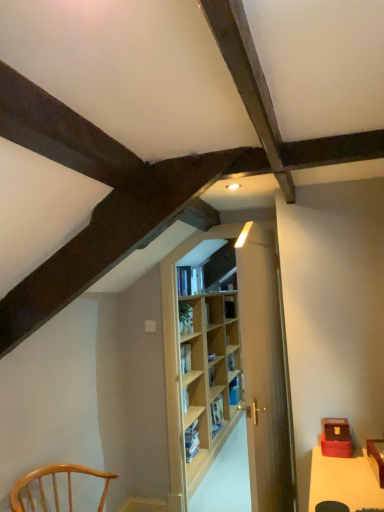
At what (x,y) coordinates should I click in order to perform the action: click on wooden door at center. Please return your answer as a coordinate pair (x, y). This screenshot has width=384, height=512. Looking at the image, I should click on (265, 372).

Measure the distance between light wood shelf at center and camera.

The distance of light wood shelf at center from camera is 3.34 meters.

What do you see at coordinates (54, 485) in the screenshot?
I see `light brown wooden chair at lower left` at bounding box center [54, 485].

In order to face hardcover book at center, which appears as the second book when viewed from the right, should I rotate leftwards or rightwards?

Turn right by 0.275 degrees to look at hardcover book at center, which appears as the second book when viewed from the right.

The image size is (384, 512). What do you see at coordinates (190, 280) in the screenshot? I see `hardcover book at center, the 1th book positioned from the front` at bounding box center [190, 280].

In order to click on wooden door at center in this screenshot , I will do click(265, 372).

Which of these two, blue hardcover book at center, positioned as the 2th book in top-to-bottom order, or wooden door at center, is smaller?

blue hardcover book at center, positioned as the 2th book in top-to-bottom order, is smaller.

Is wooden door at center at the back of blue hardcover book at center, placed as the second book when sorted from front to back?

No, blue hardcover book at center, placed as the second book when sorted from front to back, is not facing the opposite direction of wooden door at center.

Looking at their sizes, would you say blue hardcover book at center, arranged as the 2th book when viewed from the left, is wider or thinner than wooden door at center?

In the image, blue hardcover book at center, arranged as the 2th book when viewed from the left, appears to be more narrow than wooden door at center.

From a real-world perspective, is blue hardcover book at center, positioned as the 2th book in top-to-bottom order, positioned above or below hardcover book at center, which appears as the second book when viewed from the right?

In terms of real-world spatial position, blue hardcover book at center, positioned as the 2th book in top-to-bottom order, is below hardcover book at center, which appears as the second book when viewed from the right.

Is hardcover book at center, which appears as the second book when viewed from the right, at the back of blue hardcover book at center, placed as the second book when sorted from front to back?

That's not correct — blue hardcover book at center, placed as the second book when sorted from front to back, is not looking away from hardcover book at center, which appears as the second book when viewed from the right.

Measure the distance between blue hardcover book at center, which ranks as the first book in back-to-front order, and hardcover book at center, which is the second book in back-to-front order.

They are 5.78 feet apart.

Which object is positioned more to the left, hardcover book at center, which appears as the 2th book when ordered from the bottom, or light wood shelf at center?

Positioned to the left is hardcover book at center, which appears as the 2th book when ordered from the bottom.

Would you consider hardcover book at center, which appears as the second book when viewed from the right, to be distant from light wood shelf at center?

No, hardcover book at center, which appears as the second book when viewed from the right, is not far away from light wood shelf at center.

In terms of height, does hardcover book at center, which is the second book in back-to-front order, look taller or shorter compared to light wood shelf at center?

In the image, hardcover book at center, which is the second book in back-to-front order, appears to be shorter than light wood shelf at center.

Which is in front, point (181, 267) or point (193, 387)?

The point (181, 267) is closer to the camera.

Is wooden door at center not within light wood shelf at center?

Yes, wooden door at center is outside of light wood shelf at center.

Which object is thinner, wooden door at center or light wood shelf at center?

Thinner between the two is wooden door at center.

Is wooden door at center next to light wood shelf at center and touching it?

wooden door at center is not next to light wood shelf at center, and they're not touching.

Which point is more forward, (249, 257) or (240, 373)?

Positioned in front is point (249, 257).

Consider the image. From a real-world perspective, is light wood shelf at center under light brown wooden chair at lower left?

No, from a real-world perspective, light wood shelf at center is not under light brown wooden chair at lower left.

From the image's perspective, between light wood shelf at center and light brown wooden chair at lower left, who is located below?

From the image's view, light brown wooden chair at lower left is below.

Which of these two, light wood shelf at center or light brown wooden chair at lower left, is thinner?

Thinner between the two is light wood shelf at center.

Considering the positions of point (222, 426) and point (179, 275), is point (222, 426) closer or farther from the camera than point (179, 275)?

Point (222, 426) is positioned farther from the camera compared to point (179, 275).

Considering the relative sizes of light wood shelf at center and hardcover book at center, which appears as the 2th book when ordered from the bottom, in the image provided, is light wood shelf at center taller than hardcover book at center, which appears as the 2th book when ordered from the bottom,?

Indeed, light wood shelf at center has a greater height compared to hardcover book at center, which appears as the 2th book when ordered from the bottom.

At what (x,y) coordinates should I click in order to perform the action: click on book that is above the light wood shelf at center (from the image's perspective). Please return your answer as a coordinate pair (x, y). The width and height of the screenshot is (384, 512). Looking at the image, I should click on (190, 280).

Looking at their sizes, would you say light wood shelf at center is wider or thinner than hardcover book at center, which is the second book in back-to-front order?

Considering their sizes, light wood shelf at center looks broader than hardcover book at center, which is the second book in back-to-front order.

Which of these two, hardcover book at center, positioned as the first book in top-to-bottom order, or light brown wooden chair at lower left, stands taller?

Standing taller between the two is light brown wooden chair at lower left.

Does point (189, 290) lie behind point (21, 500)?

Yes, it is.

From the image's perspective, is hardcover book at center, which is the second book in back-to-front order, on light brown wooden chair at lower left?

Yes.

Find the location of a particular element. the 2nd book behind the wooden door at center is located at coordinates (235, 390).

This screenshot has width=384, height=512. In the image, there is a hardcover book at center, the first book positioned from the left. Find the location of `book below it (from a real-world perspective)`. book below it (from a real-world perspective) is located at coordinates (235, 390).

Considering their positions, is light wood shelf at center positioned further to wooden door at center than blue hardcover book at center, which is the first book in right-to-left order?

blue hardcover book at center, which is the first book in right-to-left order, lies further to wooden door at center than the other object.

Based on their spatial positions, is light brown wooden chair at lower left or light wood shelf at center further from wooden door at center?

light wood shelf at center is positioned further to the anchor wooden door at center.

Estimate the real-world distances between objects in this image. Which object is further from light brown wooden chair at lower left, blue hardcover book at center, which is the first book in right-to-left order, or hardcover book at center, which appears as the 2th book when ordered from the bottom?

Based on the image, blue hardcover book at center, which is the first book in right-to-left order, appears to be further to light brown wooden chair at lower left.

From the image, which object appears to be nearer to hardcover book at center, which appears as the second book when viewed from the right, blue hardcover book at center, which is the first book in right-to-left order, or wooden door at center?

Based on the image, wooden door at center appears to be nearer to hardcover book at center, which appears as the second book when viewed from the right.

Which object lies further to the anchor point blue hardcover book at center, positioned as the 2th book in top-to-bottom order, wooden door at center or hardcover book at center, which appears as the second book when viewed from the right?

wooden door at center is positioned further to the anchor blue hardcover book at center, positioned as the 2th book in top-to-bottom order.

Based on their spatial positions, is light wood shelf at center or hardcover book at center, which appears as the 2th book when ordered from the bottom, further from light brown wooden chair at lower left?

light wood shelf at center.

Based on the photo, when comparing their distances from blue hardcover book at center, which is the 1th book in bottom-to-top order, does light wood shelf at center or hardcover book at center, which appears as the second book when viewed from the right, seem further?

hardcover book at center, which appears as the second book when viewed from the right, is further to blue hardcover book at center, which is the 1th book in bottom-to-top order.

Estimate the real-world distances between objects in this image. Which object is further from hardcover book at center, the first book positioned from the left, light wood shelf at center or blue hardcover book at center, placed as the second book when sorted from front to back?

blue hardcover book at center, placed as the second book when sorted from front to back, lies further to hardcover book at center, the first book positioned from the left, than the other object.

The image size is (384, 512). I want to click on shelf between wooden door at center and blue hardcover book at center, placed as the second book when sorted from front to back, from front to back, so click(x=207, y=377).

You are a GUI agent. You are given a task and a screenshot of the screen. Output one action in this format:
    pyautogui.click(x=<x>, y=<y>)
    Task: Click on the shelf between wooden door at center and hardcover book at center, the 1th book positioned from the front, from front to back
    
    Given the screenshot: What is the action you would take?
    pyautogui.click(x=207, y=377)

Where is `book located between light wood shelf at center and blue hardcover book at center, placed as the second book when sorted from front to back, in the depth direction`? The width and height of the screenshot is (384, 512). book located between light wood shelf at center and blue hardcover book at center, placed as the second book when sorted from front to back, in the depth direction is located at coordinates (190, 280).

Locate an element on the screen. shelf between light brown wooden chair at lower left and blue hardcover book at center, arranged as the 2th book when viewed from the left, along the z-axis is located at coordinates (x=207, y=377).